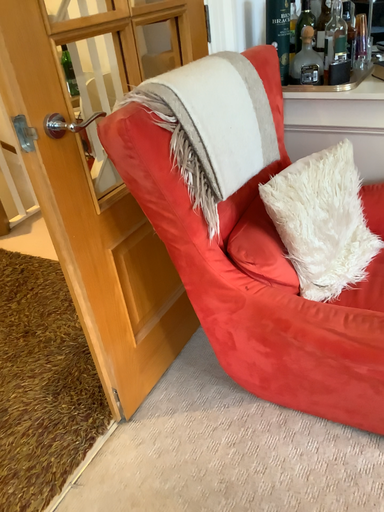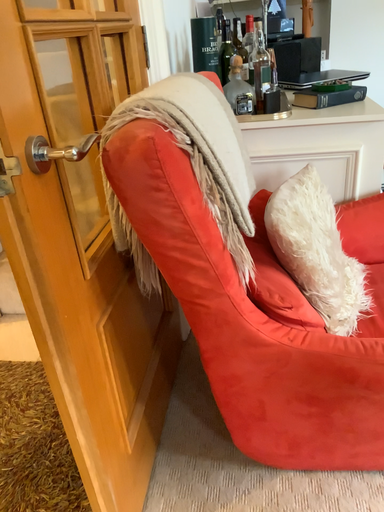
Question: Which way did the camera rotate in the video?

Choices:
 (A) rotated right
 (B) rotated left

Answer: (A)